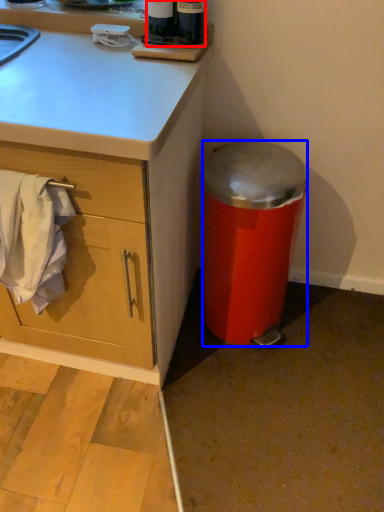
Question: Which point is closer to the camera, bottle (highlighted by a red box) or trash bin/can (highlighted by a blue box)?

Choices:
 (A) bottle
 (B) trash bin/can

Answer: (A)